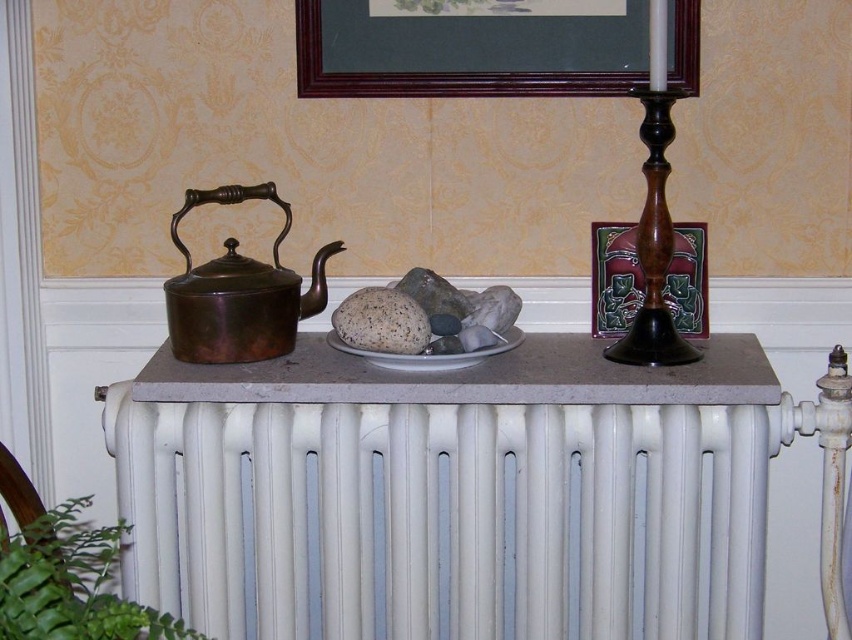
In the scene shown: Who is more forward, (266, 321) or (640, 262)?

Point (640, 262)

In the scene shown: Does bronze metallic teapot at left appear on the left side of wooden candlestick at right?

Yes, bronze metallic teapot at left is to the left of wooden candlestick at right.

The height and width of the screenshot is (640, 852). I want to click on bronze metallic teapot at left, so (239, 291).

At what (x,y) coordinates should I click in order to perform the action: click on bronze metallic teapot at left. Please return your answer as a coordinate pair (x, y). The image size is (852, 640). Looking at the image, I should click on (x=239, y=291).

Does white painted radiator at center lie in front of wooden picture frame at upper center?

Yes, white painted radiator at center is in front of wooden picture frame at upper center.

Can you confirm if white painted radiator at center is positioned above wooden picture frame at upper center?

No, white painted radiator at center is not above wooden picture frame at upper center.

Between point (563, 564) and point (623, 10), which one is positioned behind?

Positioned behind is point (623, 10).

The height and width of the screenshot is (640, 852). Find the location of `white painted radiator at center`. white painted radiator at center is located at coordinates (462, 513).

Can you confirm if bronze metallic teapot at left is positioned above green leafy plant at lower left?

Yes, bronze metallic teapot at left is above green leafy plant at lower left.

Between bronze metallic teapot at left and green leafy plant at lower left, which one is positioned higher?

bronze metallic teapot at left is above.

Does point (231, 241) come closer to viewer compared to point (56, 632)?

No, it is behind (56, 632).

Find the location of `bronze metallic teapot at left`. bronze metallic teapot at left is located at coordinates (239, 291).